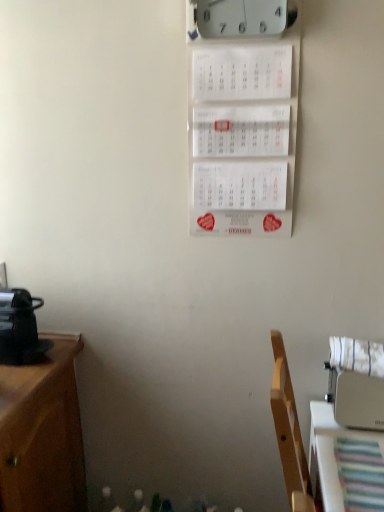
Question: Is white fabric chair at right inside or outside of white plastic clock at upper center?

Choices:
 (A) inside
 (B) outside

Answer: (B)

Question: Considering the positions of point (322, 459) and point (276, 18), is point (322, 459) closer or farther from the camera than point (276, 18)?

Choices:
 (A) farther
 (B) closer

Answer: (B)

Question: From a real-world perspective, is white fabric chair at right above or below white plastic clock at upper center?

Choices:
 (A) above
 (B) below

Answer: (B)

Question: Is white plastic clock at upper center situated inside white fabric chair at right or outside?

Choices:
 (A) inside
 (B) outside

Answer: (B)

Question: Is white plastic clock at upper center wider or thinner than white fabric chair at right?

Choices:
 (A) thin
 (B) wide

Answer: (A)

Question: In the image, is white plastic clock at upper center positioned in front of or behind white fabric chair at right?

Choices:
 (A) behind
 (B) front

Answer: (A)

Question: Is white plastic clock at upper center taller or shorter than white fabric chair at right?

Choices:
 (A) short
 (B) tall

Answer: (A)